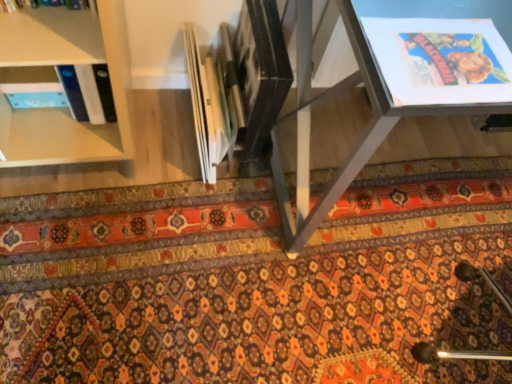
Question: Could carpeted mat at center be considered to be inside metallic gray table at center?

Choices:
 (A) yes
 (B) no

Answer: (B)

Question: From the image's perspective, is metallic gray table at center below carpeted mat at center?

Choices:
 (A) yes
 (B) no

Answer: (B)

Question: Is metallic gray table at center wider than carpeted mat at center?

Choices:
 (A) no
 (B) yes

Answer: (A)

Question: From the image's perspective, does metallic gray table at center appear higher than carpeted mat at center?

Choices:
 (A) no
 (B) yes

Answer: (B)

Question: Is metallic gray table at center far away from carpeted mat at center?

Choices:
 (A) yes
 (B) no

Answer: (B)

Question: From a real-world perspective, is metallic gray table at center on carpeted mat at center?

Choices:
 (A) no
 (B) yes

Answer: (B)

Question: From the image's perspective, does carpeted mat at center appear lower than metallic gray table at center?

Choices:
 (A) no
 (B) yes

Answer: (B)

Question: From the image's perspective, is carpeted mat at center on top of metallic gray table at center?

Choices:
 (A) yes
 (B) no

Answer: (B)

Question: Considering the relative sizes of carpeted mat at center and metallic gray table at center in the image provided, is carpeted mat at center thinner than metallic gray table at center?

Choices:
 (A) yes
 (B) no

Answer: (B)

Question: Is carpeted mat at center smaller than metallic gray table at center?

Choices:
 (A) yes
 (B) no

Answer: (A)

Question: Considering the relative positions of carpeted mat at center and metallic gray table at center in the image provided, is carpeted mat at center to the left of metallic gray table at center from the viewer's perspective?

Choices:
 (A) yes
 (B) no

Answer: (A)

Question: Does carpeted mat at center appear on the right side of metallic gray table at center?

Choices:
 (A) no
 (B) yes

Answer: (A)

Question: Is carpeted mat at center in front of or behind metallic gray table at center in the image?

Choices:
 (A) front
 (B) behind

Answer: (B)